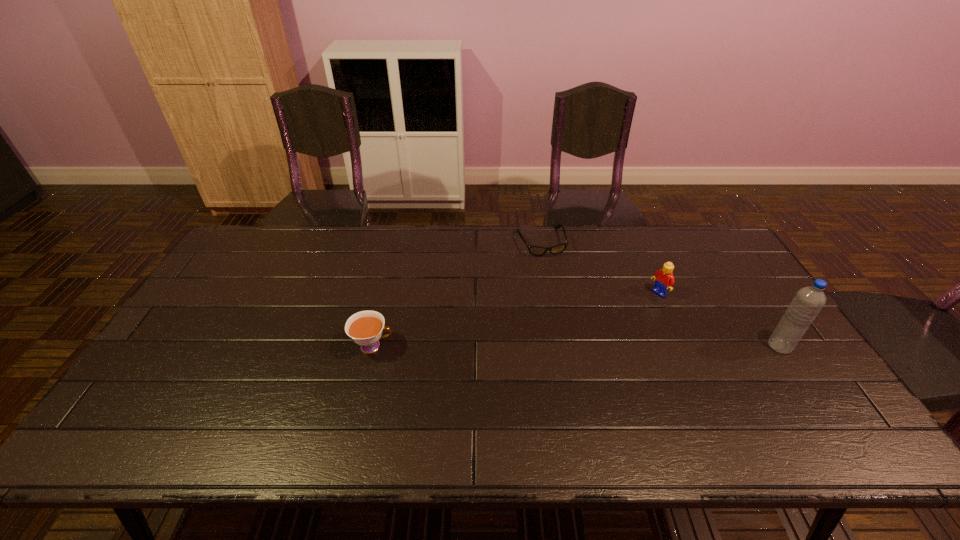
Identify the location of free space on the desktop that is between the teacup and the rightmost object and is positioned on the front-facing side of the Lego. The height and width of the screenshot is (540, 960). (575, 346).

The image size is (960, 540). In order to click on vacant space on the desktop that is between the teacup and the tallest object and is positioned on the front-facing side of the farthest object in this screenshot , I will do `click(580, 346)`.